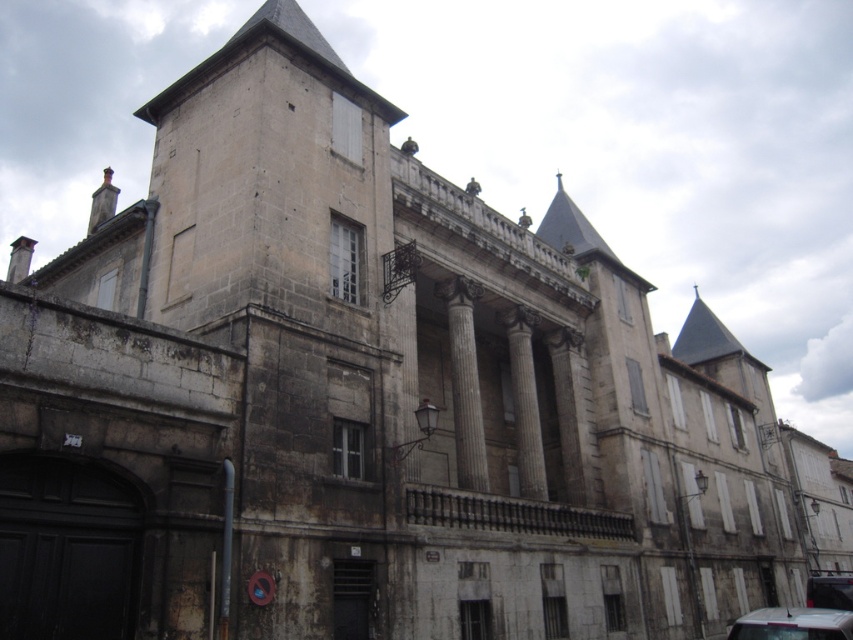
Who is more forward, (x=805, y=625) or (x=817, y=573)?

Point (x=805, y=625)

Between white glossy car at lower right and metallic silver car at lower right, which one is positioned higher?

Positioned higher is white glossy car at lower right.

Who is more forward, (x=839, y=637) or (x=838, y=608)?

Positioned in front is point (x=839, y=637).

What are the coordinates of `white glossy car at lower right` in the screenshot? It's located at (792, 624).

Does smooth stone column at center have a lesser height compared to metallic silver car at lower right?

Correct, smooth stone column at center is not as tall as metallic silver car at lower right.

Which is more to the left, smooth stone column at center or metallic silver car at lower right?

From the viewer's perspective, smooth stone column at center appears more on the left side.

At what (x,y) coordinates should I click in order to perform the action: click on smooth stone column at center. Please return your answer as a coordinate pair (x, y). The width and height of the screenshot is (853, 640). Looking at the image, I should click on (525, 403).

What do you see at coordinates (525, 403) in the screenshot? The width and height of the screenshot is (853, 640). I see `smooth stone column at center` at bounding box center [525, 403].

Based on the photo, between smooth stone column at center and white glossy car at lower right, which one appears on the right side from the viewer's perspective?

white glossy car at lower right is more to the right.

Which is behind, point (521, 392) or point (840, 612)?

Point (521, 392)

Where is `smooth stone column at center`? This screenshot has height=640, width=853. smooth stone column at center is located at coordinates (525, 403).